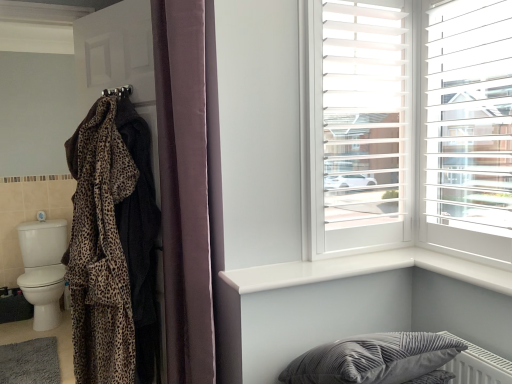
Question: In the image, is leopard print robe at left on the left side or the right side of white glossy window sill at upper right?

Choices:
 (A) left
 (B) right

Answer: (A)

Question: From a real-world perspective, is leopard print robe at left physically located above or below white glossy window sill at upper right?

Choices:
 (A) above
 (B) below

Answer: (A)

Question: Which is nearer to the soft gray carpet at lower left?

Choices:
 (A) leopard print fabric robe at left
 (B) leopard print fabric at left
 (C) white plastic blinds at upper right
 (D) white plastic window frame at upper right
 (E) velvet curtain at center

Answer: (B)

Question: Estimate the real-world distances between objects in this image. Which object is closer to the soft gray carpet at lower left?

Choices:
 (A) velvet gray pillow at lower right
 (B) leopard print fabric at left
 (C) white glossy window sill at upper right
 (D) velvet curtain at center
 (E) leopard print fabric robe at left

Answer: (B)